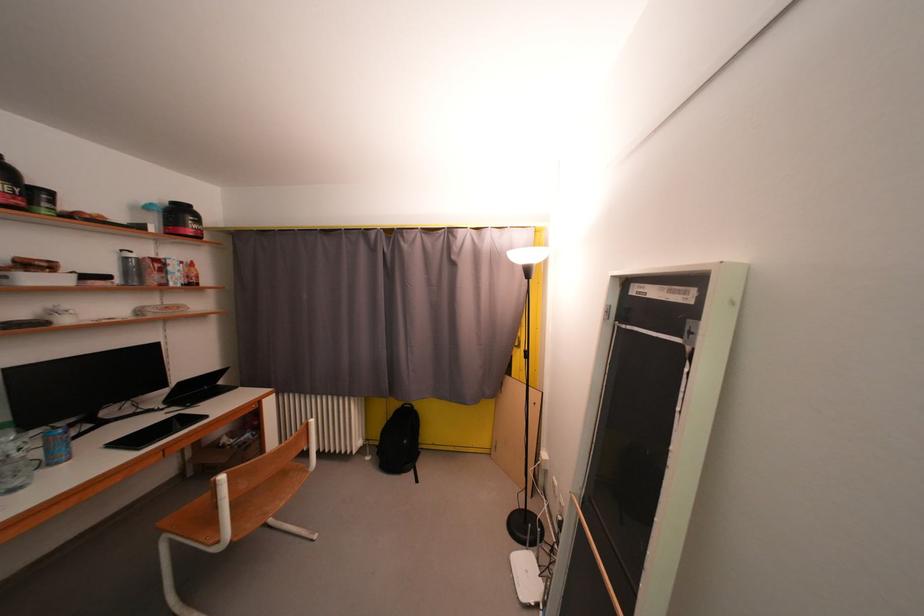
Where is `black door handle`? The height and width of the screenshot is (616, 924). black door handle is located at coordinates (596, 568).